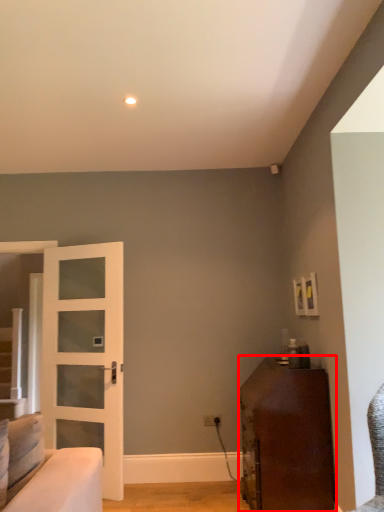
Question: In this image, where is furniture (annotated by the red box) located relative to door?

Choices:
 (A) left
 (B) right

Answer: (B)